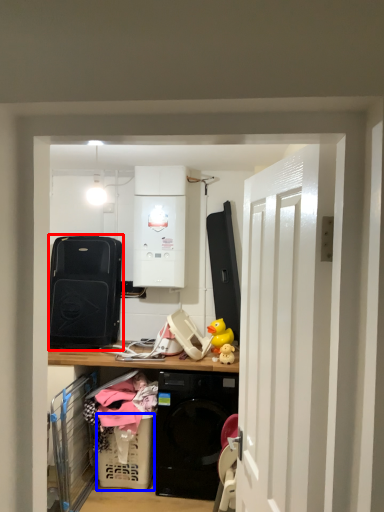
Question: Which object appears farthest to the camera in this image, appliance (highlighted by a red box) or basket (highlighted by a blue box)?

Choices:
 (A) appliance
 (B) basket

Answer: (A)